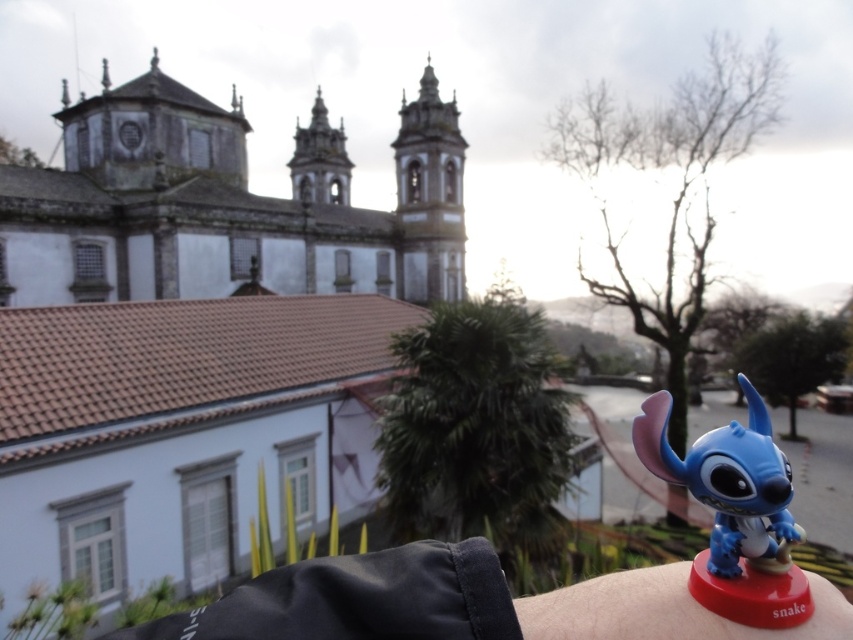
Question: Which of these objects is positioned farthest from the blue plastic toy at lower right?

Choices:
 (A) blue matte toy at lower right
 (B) blue matte toy at upper right

Answer: (A)

Question: Is blue matte toy at upper right behind blue plastic toy at lower right?

Choices:
 (A) yes
 (B) no

Answer: (B)

Question: Which object is positioned farthest from the blue matte toy at lower right?

Choices:
 (A) blue plastic toy at lower right
 (B) blue matte toy at upper right

Answer: (B)

Question: Does blue matte toy at lower right lie in front of blue plastic toy at lower right?

Choices:
 (A) yes
 (B) no

Answer: (B)

Question: Among these points, which one is farthest from the camera?

Choices:
 (A) (389, 596)
 (B) (550, 620)

Answer: (B)

Question: Where is blue matte toy at lower right located in relation to blue plastic toy at lower right in the image?

Choices:
 (A) left
 (B) right

Answer: (B)